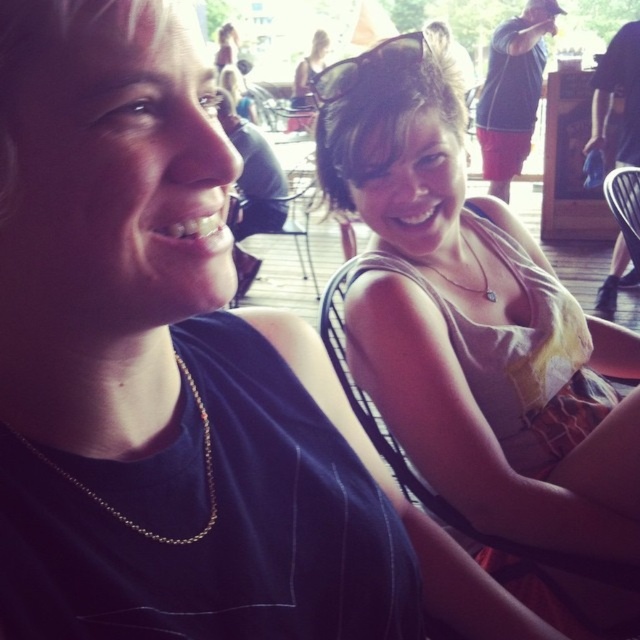
Question: Among these points, which one is farthest from the camera?

Choices:
 (A) (445, 276)
 (B) (323, 99)
 (C) (202, 445)
 (D) (396, 129)

Answer: (A)

Question: Based on their relative distances, which object is nearer to the gold chain necklace at left?

Choices:
 (A) black plastic sunglasses at upper center
 (B) matte beige tank top at center
 (C) gold chain necklace at upper center

Answer: (A)

Question: Is black plastic sunglasses at upper center to the left of gold chain necklace at left from the viewer's perspective?

Choices:
 (A) yes
 (B) no

Answer: (B)

Question: Which object is the closest to the matte beige tank top at center?

Choices:
 (A) black plastic sunglasses at upper center
 (B) gold chain necklace at left

Answer: (A)

Question: Can you confirm if gold chain necklace at left is thinner than gold chain necklace at upper center?

Choices:
 (A) no
 (B) yes

Answer: (B)

Question: Is matte beige tank top at center smaller than gold chain necklace at left?

Choices:
 (A) no
 (B) yes

Answer: (A)